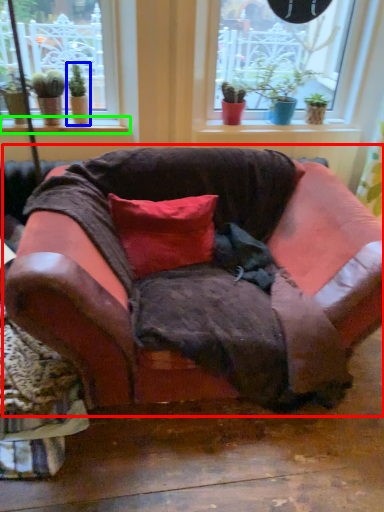
Question: Which object is positioned closest to studio couch (highlighted by a red box)? Select from houseplant (highlighted by a blue box) and window sill (highlighted by a green box).

Choices:
 (A) houseplant
 (B) window sill

Answer: (B)